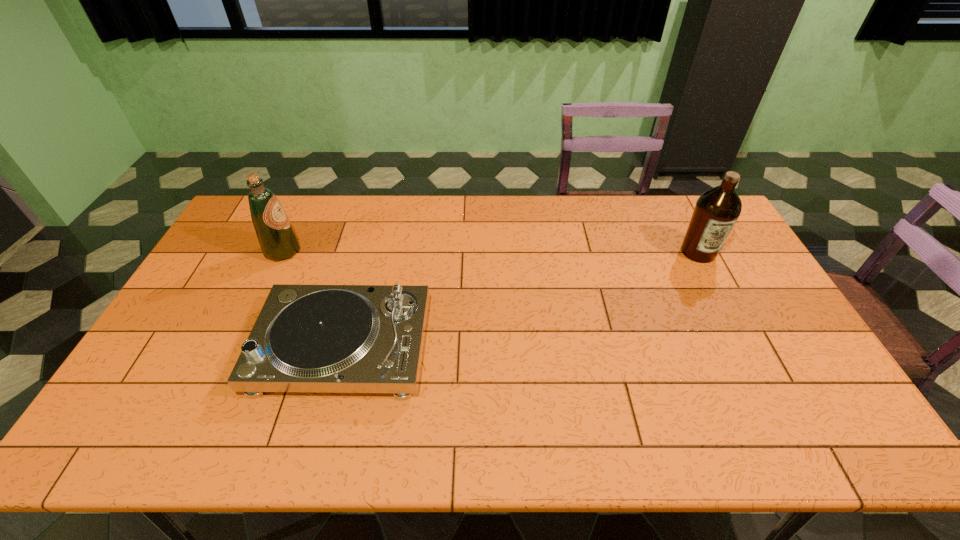
This screenshot has width=960, height=540. In order to click on the rightmost object in this screenshot , I will do `click(716, 211)`.

Find the location of a particular element. This screenshot has width=960, height=540. the left olive oil is located at coordinates (278, 241).

The height and width of the screenshot is (540, 960). What are the coordinates of `record player` in the screenshot? It's located at (307, 338).

Locate an element on the screen. The width and height of the screenshot is (960, 540). the shortest object is located at coordinates (307, 338).

This screenshot has height=540, width=960. I want to click on free space located 0.110m on the label of the rightmost object, so pos(718,290).

At what (x,y) coordinates should I click in order to perform the action: click on free spot located on the front-facing side of the left olive oil. Please return your answer as a coordinate pair (x, y). Looking at the image, I should click on (370, 251).

Where is `vacant area situated 0.080m on the left of the record player`? This screenshot has height=540, width=960. vacant area situated 0.080m on the left of the record player is located at coordinates (231, 346).

Where is `object situated at the left edge`? object situated at the left edge is located at coordinates (278, 241).

Find the location of `object that is at the right edge`. object that is at the right edge is located at coordinates (716, 211).

This screenshot has width=960, height=540. In the image, there is a desktop. In order to click on free space at the far edge in this screenshot , I will do `click(459, 211)`.